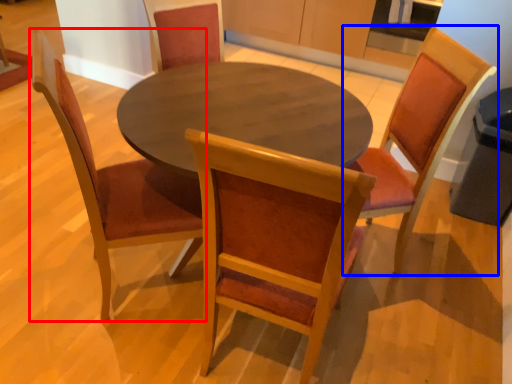
Question: Which point is closer to the camera, chair (highlighted by a red box) or chair (highlighted by a blue box)?

Choices:
 (A) chair
 (B) chair

Answer: (A)